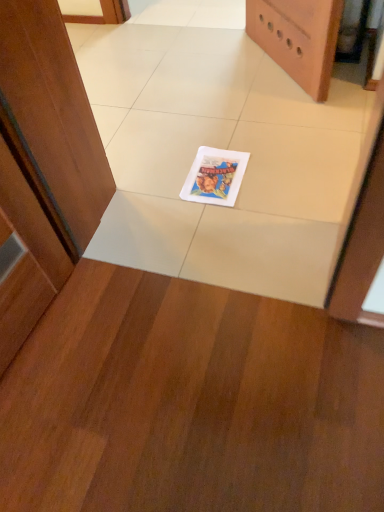
Image resolution: width=384 pixels, height=512 pixels. I want to click on free space to the right of matte white comic book at center, so click(x=280, y=163).